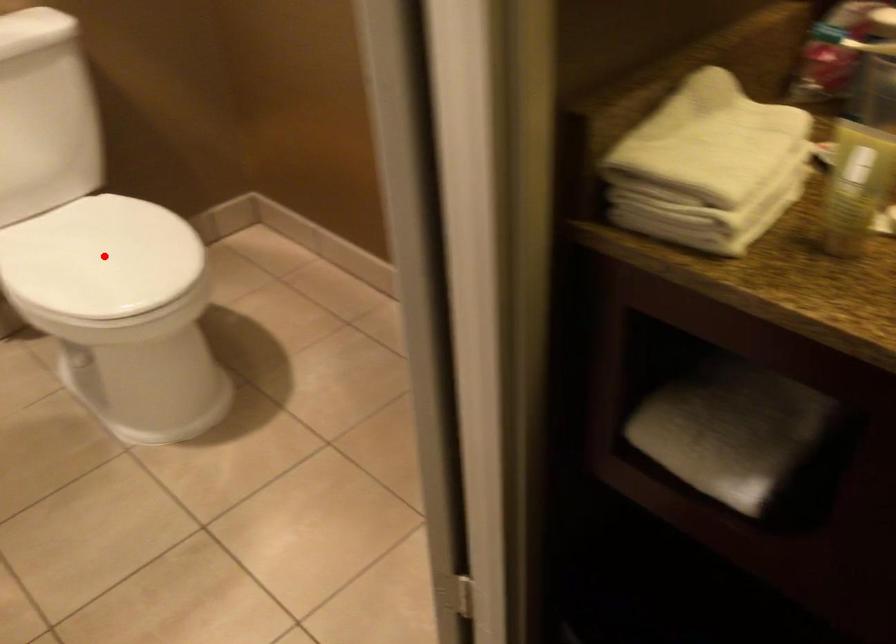
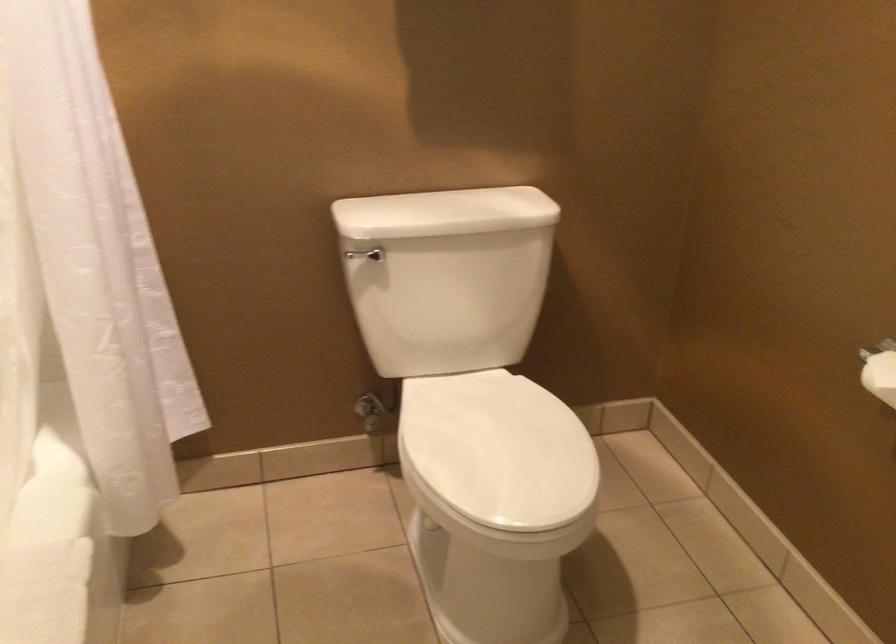
Locate, in the second image, the point that corresponds to the highlighted location in the first image.

(498, 450)